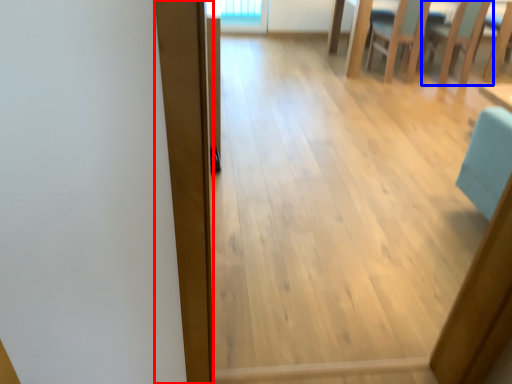
Question: Which point is further to the camera, plank (highlighted by a red box) or armchair (highlighted by a blue box)?

Choices:
 (A) plank
 (B) armchair

Answer: (B)